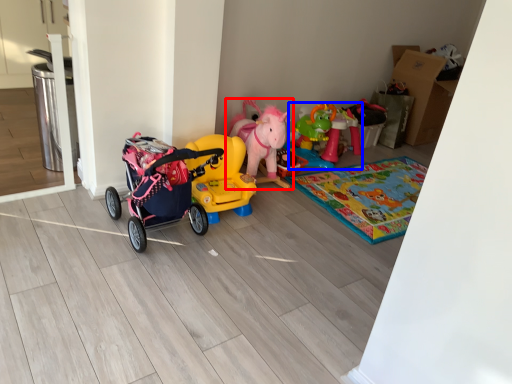
Question: Which of the following is the farthest to the observer, toy (highlighted by a red box) or toy (highlighted by a blue box)?

Choices:
 (A) toy
 (B) toy

Answer: (B)